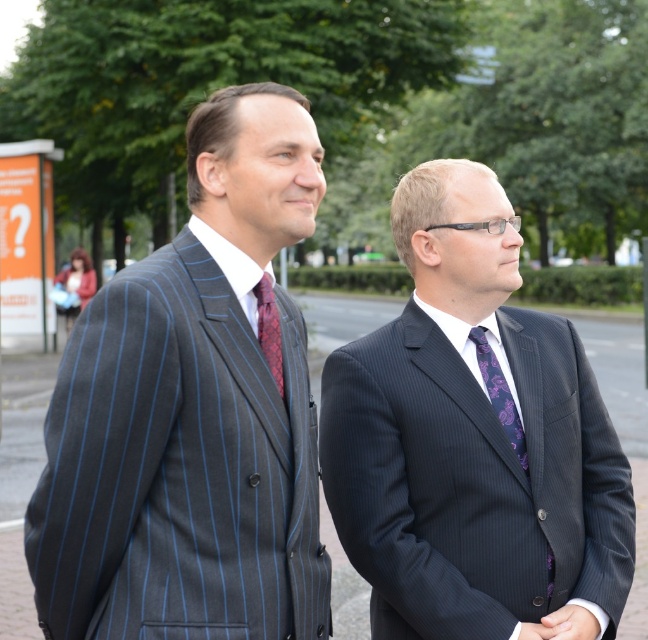
You are a photographer trying to capture a closeup shot of the red textured tie at center without including the pinstriped suit at left in the frame. Given that the distance between them is 10.41 inches, what is the minimum focal length you should use to ensure both are not in the same shot?

The pinstriped suit at left and red textured tie at center are 10.41 inches apart. To avoid including the pinstriped suit at left in the frame while focusing on the red textured tie at center, the photographer should use a focal length that ensures the field of view is narrow enough to exclude the 10.41 inches distance between them. However, without knowing the camera sensor size or desired magnification, an exact focal length cannot be determined. A longer focal length would compress the perspective and is

You are a photographer trying to capture a closeup of the purple silk tie at center without including the pinstriped suit at left in the frame. Based on their positions, is this possible?

The pinstriped suit at left is to the left of the purple silk tie at center, so if you position yourself to the right of the purple silk tie at center and frame the shot to exclude the left side, you can capture the purple silk tie at center without including the pinstriped suit at left.